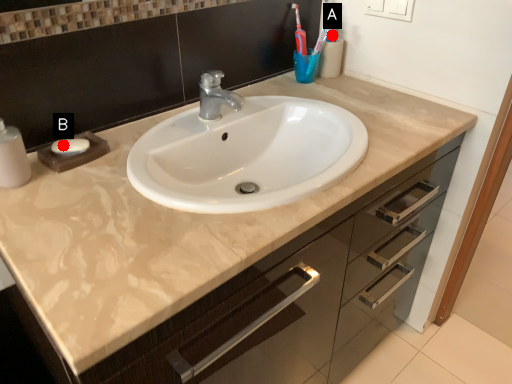
Question: Two points are circled on the image, labeled by A and B beside each circle. Among these points, which one is nearest to the camera?

Choices:
 (A) A is closer
 (B) B is closer

Answer: (B)